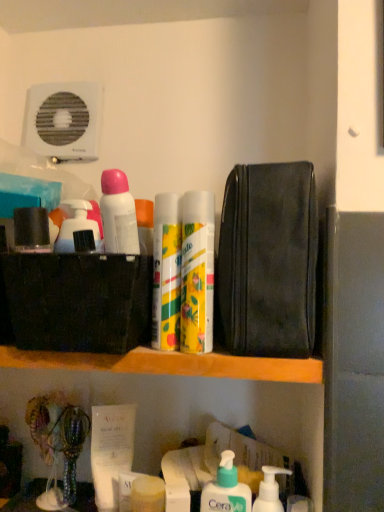
Question: Considering the relative sizes of white pump bottle at lower center, the 5th toiletry when ordered from left to right, and black leather pouch at upper right in the image provided, is white pump bottle at lower center, the 5th toiletry when ordered from left to right, thinner than black leather pouch at upper right?

Choices:
 (A) no
 (B) yes

Answer: (B)

Question: Is white pump bottle at lower center, which is the second toiletry from bottom to top, further to the viewer compared to black leather pouch at upper right?

Choices:
 (A) yes
 (B) no

Answer: (A)

Question: Is white pump bottle at lower center, the 1th toiletry viewed from the right, placed right next to black leather pouch at upper right?

Choices:
 (A) no
 (B) yes

Answer: (A)

Question: Considering the relative positions of white pump bottle at lower center, the 5th toiletry when ordered from left to right, and black leather pouch at upper right in the image provided, is white pump bottle at lower center, the 5th toiletry when ordered from left to right, to the left of black leather pouch at upper right from the viewer's perspective?

Choices:
 (A) no
 (B) yes

Answer: (B)

Question: Is the depth of white pump bottle at lower center, the 1th toiletry viewed from the right, less than that of black leather pouch at upper right?

Choices:
 (A) yes
 (B) no

Answer: (B)

Question: Based on their sizes in the image, would you say white matte deodorant at upper left, which ranks as the first toiletry in top-to-bottom order, is bigger or smaller than matte yellow soap at lower center, the first toiletry positioned from the bottom?

Choices:
 (A) big
 (B) small

Answer: (A)

Question: Does point (114, 228) appear closer or farther from the camera than point (150, 504)?

Choices:
 (A) farther
 (B) closer

Answer: (B)

Question: Considering their positions, is white matte deodorant at upper left, which ranks as the first toiletry in top-to-bottom order, located in front of or behind matte yellow soap at lower center, placed as the fifth toiletry when sorted from top to bottom?

Choices:
 (A) behind
 (B) front

Answer: (B)

Question: In terms of width, does white matte deodorant at upper left, placed as the 5th toiletry when sorted from bottom to top, look wider or thinner when compared to matte yellow soap at lower center, acting as the 3th toiletry starting from the left?

Choices:
 (A) wide
 (B) thin

Answer: (A)

Question: Considering the positions of point (119, 232) and point (29, 211), is point (119, 232) closer or farther from the camera than point (29, 211)?

Choices:
 (A) farther
 (B) closer

Answer: (B)

Question: Looking at their shapes, would you say white matte deodorant at upper left, which ranks as the first toiletry in top-to-bottom order, is wider or thinner than matte black container at upper left, the fourth toiletry in the bottom-to-top sequence?

Choices:
 (A) wide
 (B) thin

Answer: (A)

Question: Is white matte deodorant at upper left, placed as the 5th toiletry when sorted from bottom to top, inside the boundaries of matte black container at upper left, which ranks as the 5th toiletry in right-to-left order, or outside?

Choices:
 (A) outside
 (B) inside

Answer: (A)

Question: Is white matte deodorant at upper left, placed as the 5th toiletry when sorted from bottom to top, taller or shorter than matte black container at upper left, the fourth toiletry in the bottom-to-top sequence?

Choices:
 (A) short
 (B) tall

Answer: (B)

Question: In the image, is white pump bottle at lower center, the 1th toiletry viewed from the right, positioned in front of or behind matte black container at upper left, the second toiletry viewed from the top?

Choices:
 (A) behind
 (B) front

Answer: (A)

Question: From the image's perspective, is white pump bottle at lower center, the 1th toiletry viewed from the right, above or below matte black container at upper left, the second toiletry viewed from the top?

Choices:
 (A) below
 (B) above

Answer: (A)